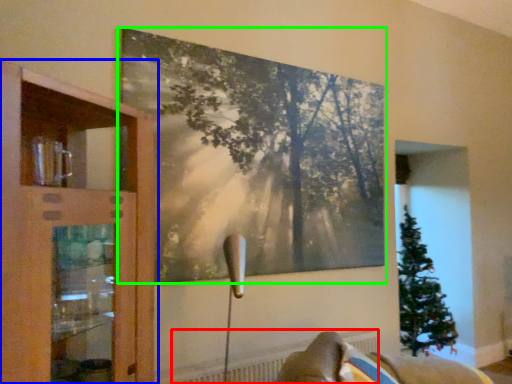
Question: Estimate the real-world distances between objects in this image. Which object is farther from radiator (highlighted by a red box), cupboard (highlighted by a blue box) or picture frame (highlighted by a green box)?

Choices:
 (A) cupboard
 (B) picture frame

Answer: (B)